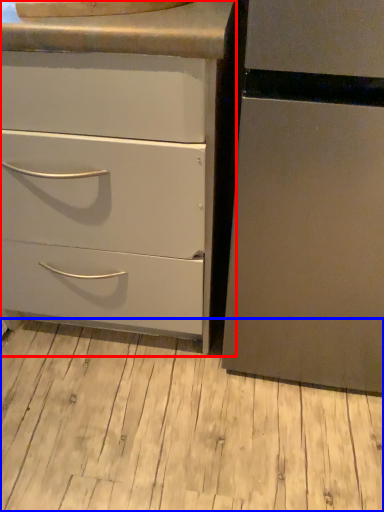
Question: Which object appears farthest to the camera in this image, chest of drawers (highlighted by a red box) or plank (highlighted by a blue box)?

Choices:
 (A) chest of drawers
 (B) plank

Answer: (B)